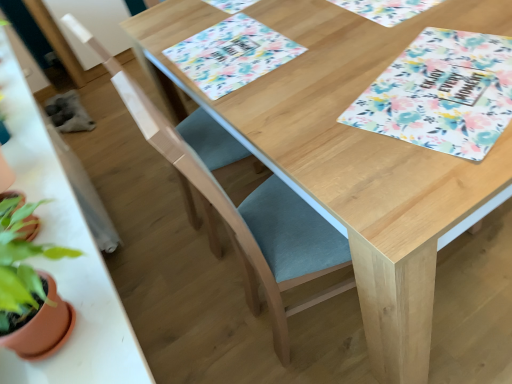
Image resolution: width=512 pixels, height=384 pixels. I want to click on free point below floral fabric placemat at upper right (from a real-world perspective), so click(452, 83).